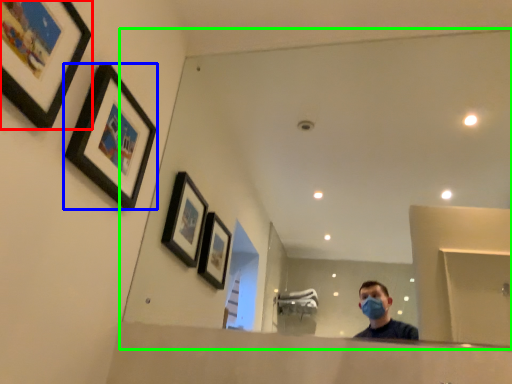
Question: Which object is positioned closest to picture frame (highlighted by a red box)? Select from picture frame (highlighted by a blue box) and mirror (highlighted by a green box).

Choices:
 (A) picture frame
 (B) mirror

Answer: (A)